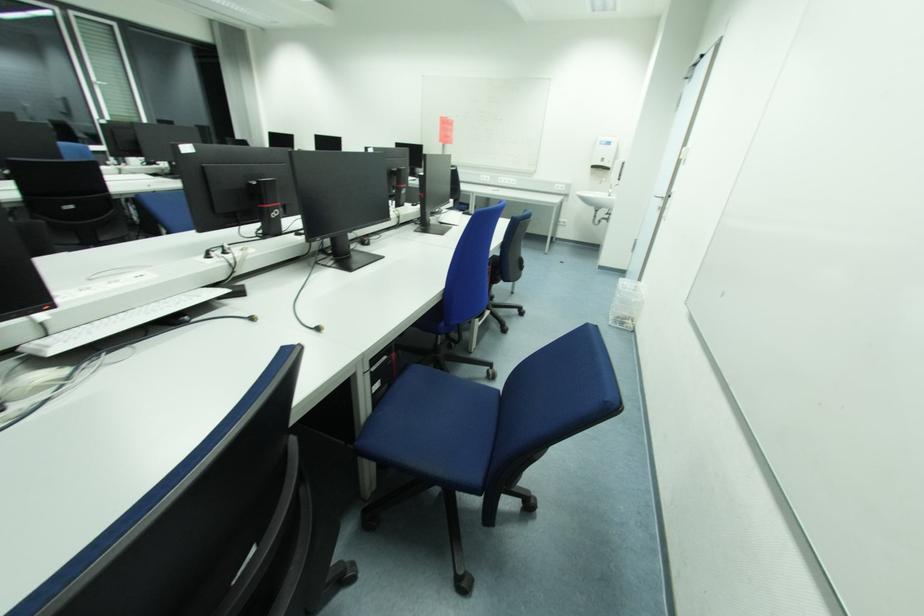
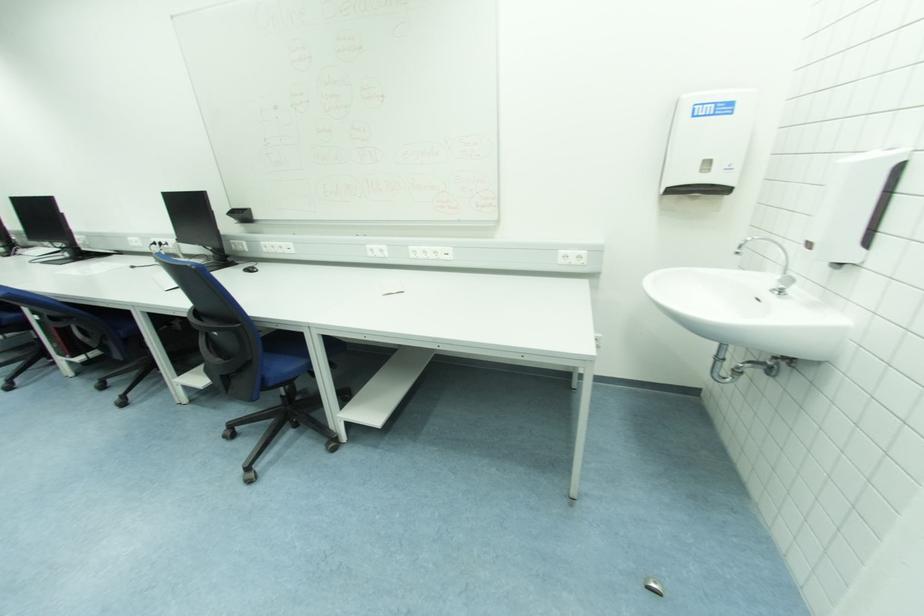
Locate, in the second image, the point that corresponds to (x=613, y=197) in the first image.

(783, 293)